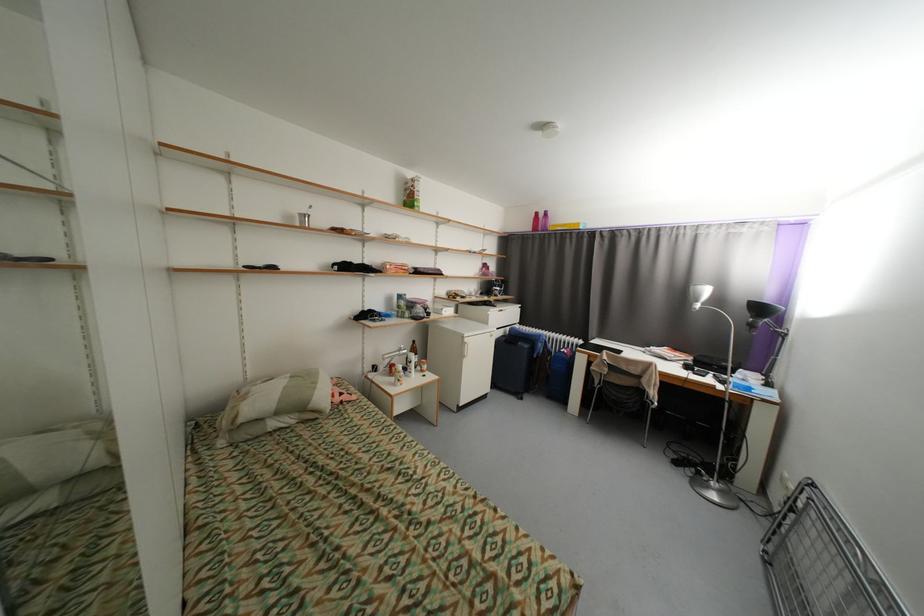
Where is `black desk lamp head`? This screenshot has width=924, height=616. black desk lamp head is located at coordinates (763, 315).